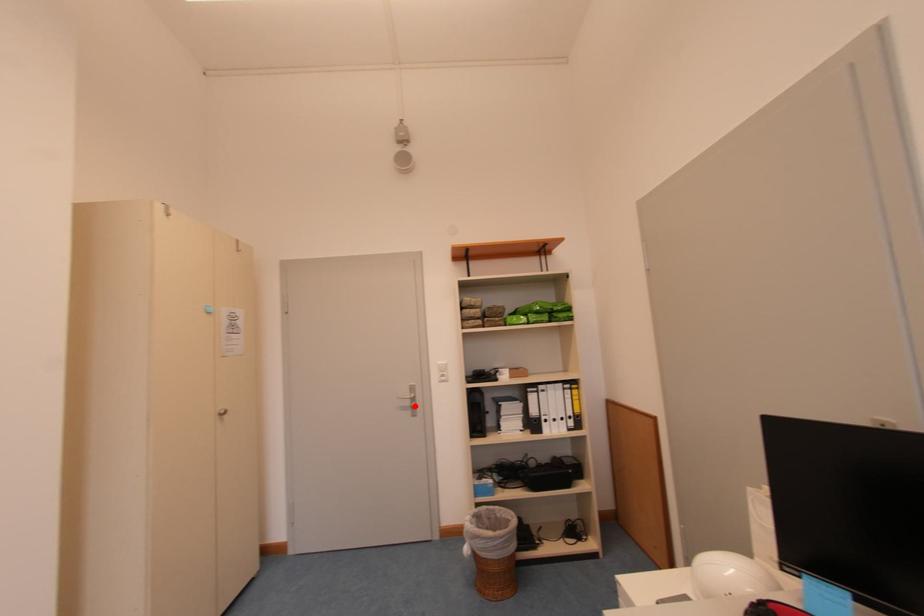
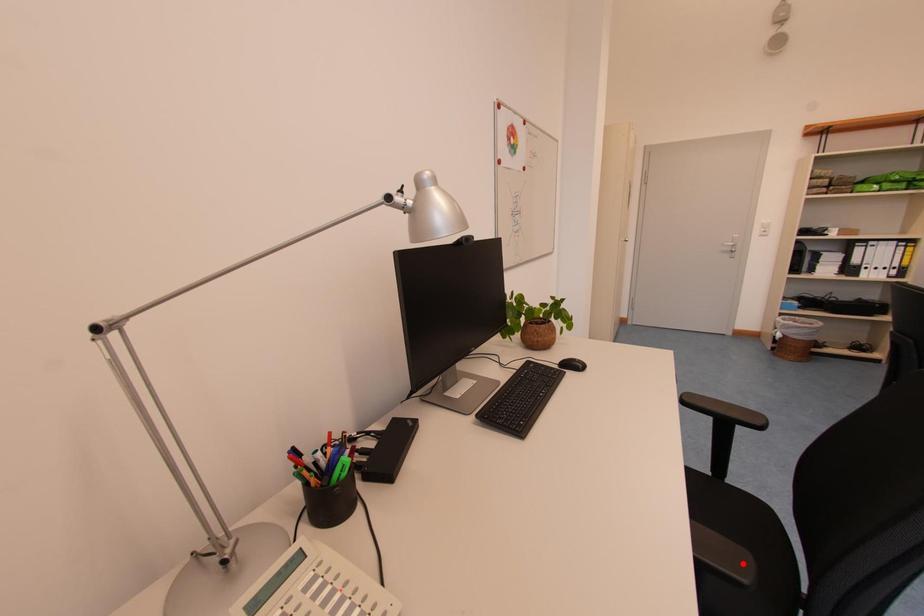
I am providing you with two images of the same scene from different viewpoints. A red point is marked on the first image and another point is marked on the second image. Do the highlighted points in image1 and image2 indicate the same real-world spot?

No